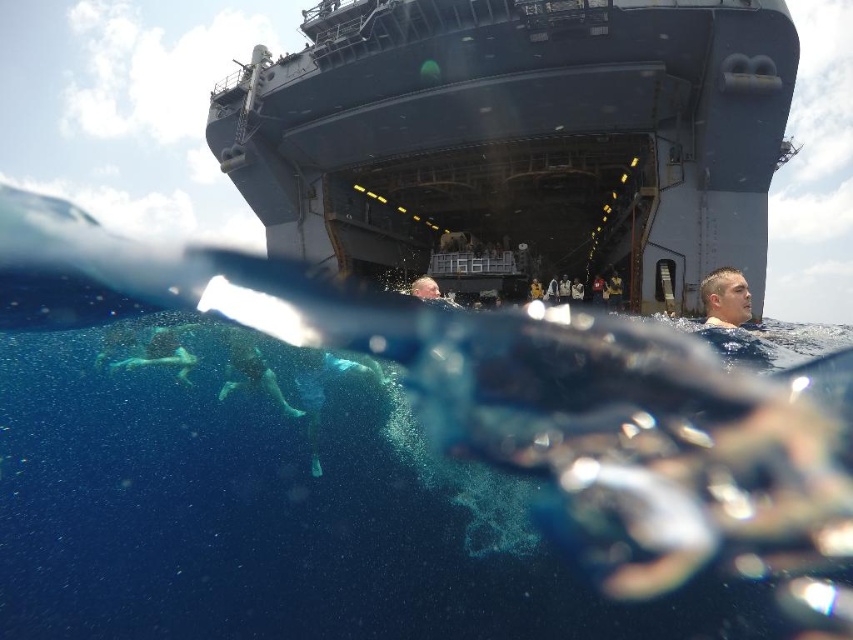
You are a photographer trying to capture a wide shot of the dark gray metallic ship at upper center and the green fabric swimmer at lower center. Based on their positions and sizes in the image, which object appears larger?

The dark gray metallic ship at upper center appears larger than the green fabric swimmer at lower center because it is wider.

You are a swimmer in the water. You see the transparent blue water at center and the green fabric swimmer at lower center. Which object is located to the right of the other?

The transparent blue water at center is to the right of the green fabric swimmer at lower center.